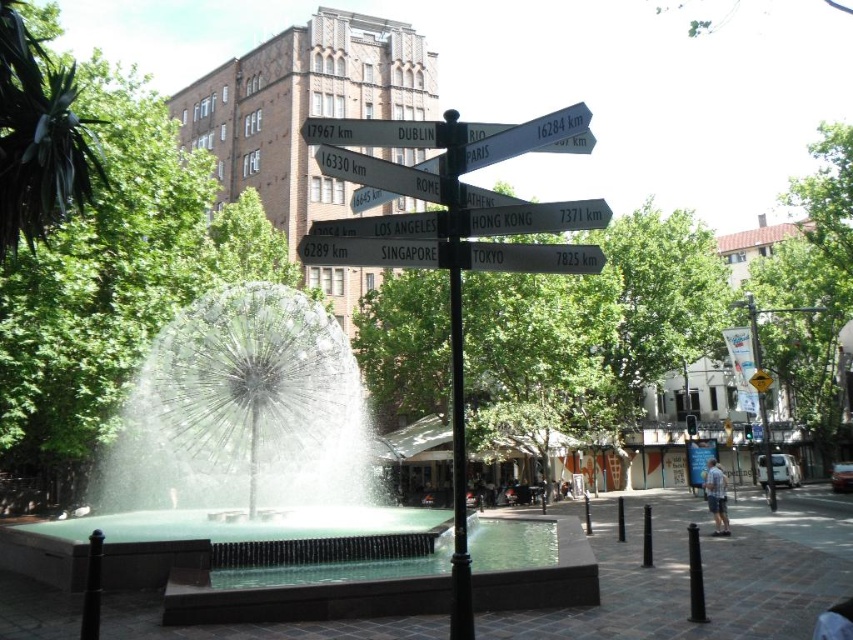
Question: Which is farther from the black metal pole at center?

Choices:
 (A) polished stone fountain at center
 (B) white plastic sign at center
 (C) white plastic signpost at center

Answer: (B)

Question: Which object is farther from the camera taking this photo?

Choices:
 (A) white plastic sign at center
 (B) polished stone fountain at center

Answer: (B)

Question: Is polished stone fountain at center to the left of black metal pole at center from the viewer's perspective?

Choices:
 (A) yes
 (B) no

Answer: (A)

Question: Is polished stone fountain at center to the right of white plastic signpost at center from the viewer's perspective?

Choices:
 (A) yes
 (B) no

Answer: (B)

Question: Can you confirm if polished stone fountain at center is positioned to the left of white plastic sign at center?

Choices:
 (A) yes
 (B) no

Answer: (A)

Question: Which point is closer to the camera?

Choices:
 (A) (426, 182)
 (B) (436, 236)
 (C) (457, 512)
 (D) (161, 465)

Answer: (A)